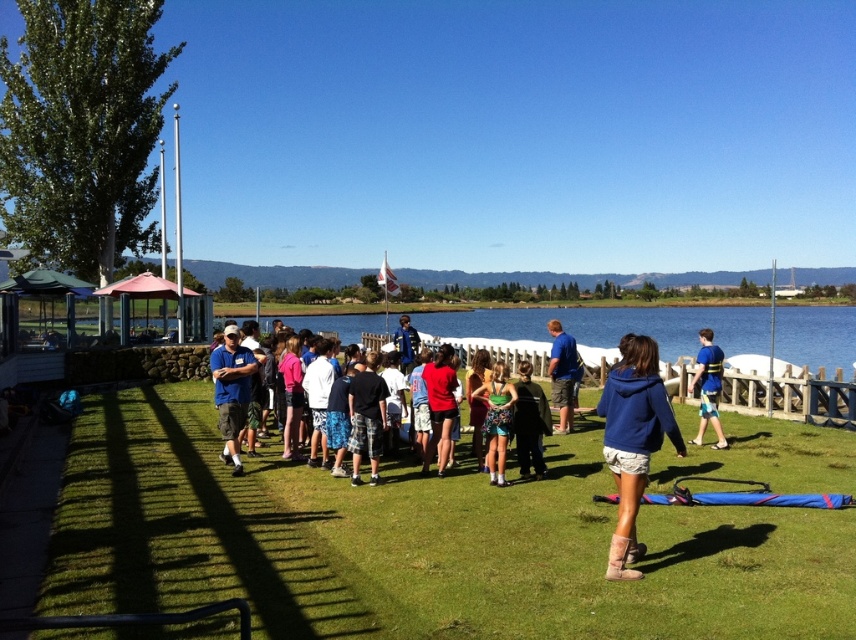
Question: Which object appears farthest from the camera in this image?

Choices:
 (A) blue fabric jacket at center
 (B) matte red shirt at center

Answer: (A)

Question: Is blue cotton shirt at center wider than blue fabric jacket at center?

Choices:
 (A) yes
 (B) no

Answer: (A)

Question: Which point is farther to the camera?

Choices:
 (A) green grass at center
 (B) blue suede boots at lower center
 (C) matte red shirt at center

Answer: (C)

Question: Does blue shirt at center appear on the right side of matte blue shirt at center?

Choices:
 (A) no
 (B) yes

Answer: (B)

Question: Which point is closer to the camera taking this photo?

Choices:
 (A) (557, 349)
 (B) (456, 417)
 (C) (702, 419)

Answer: (B)

Question: Does matte red shirt at center have a larger size compared to blue fabric jacket at center?

Choices:
 (A) yes
 (B) no

Answer: (B)